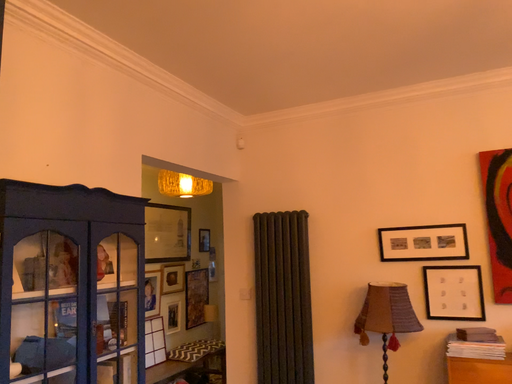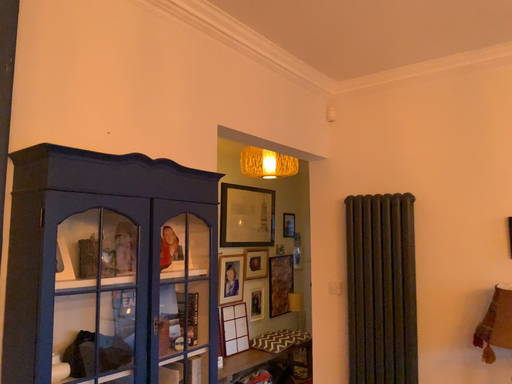
Question: Which way did the camera rotate in the video?

Choices:
 (A) rotated left
 (B) rotated right

Answer: (A)